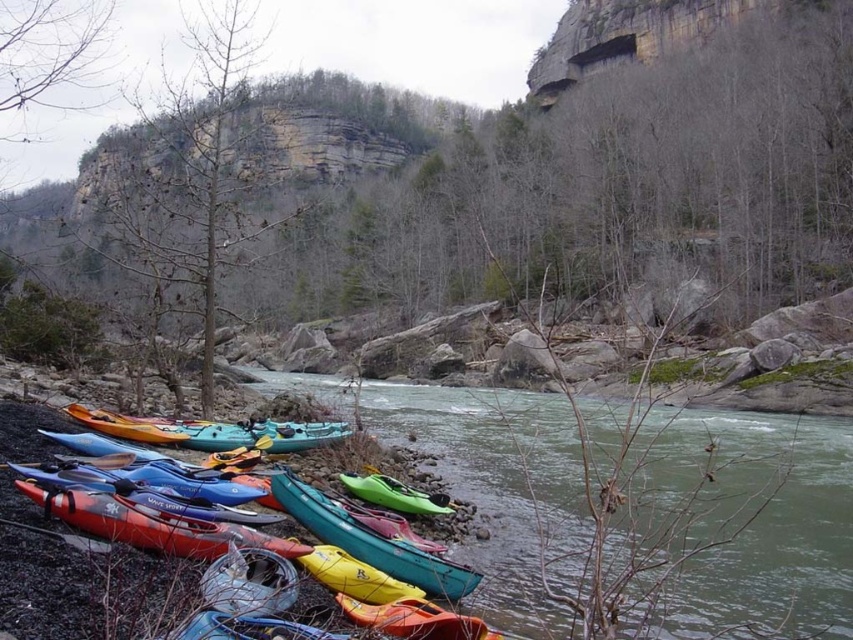
You are standing at the camera position and want to retrieve the green plastic kayaks at lower left. Can you walk directly to them without needing to go around any obstacles?

The green plastic kayaks at lower left are 15.75 meters away from the camera, so yes, you can walk directly to them since there are no obstacles mentioned in the scene description between the camera and the kayaks.